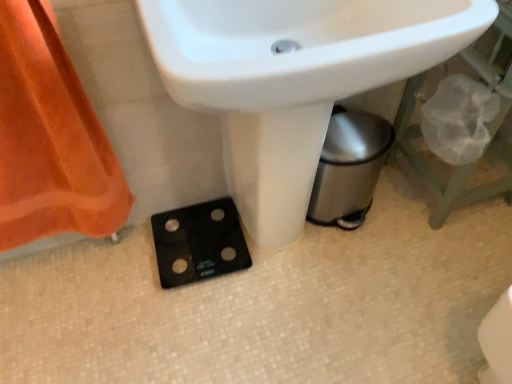
This screenshot has width=512, height=384. I want to click on spots to the right of black glass scale at lower center, so click(283, 269).